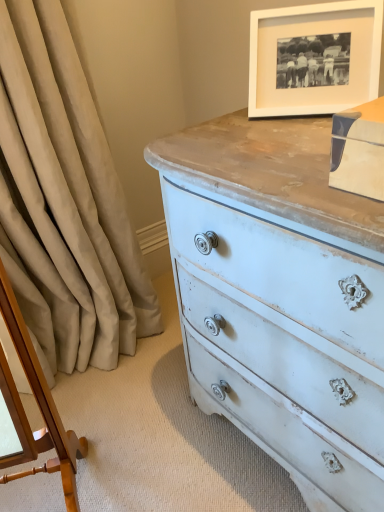
Locate an element on the screen. The height and width of the screenshot is (512, 384). wooden changing table at left is located at coordinates (40, 405).

What do you see at coordinates (64, 202) in the screenshot? The height and width of the screenshot is (512, 384). I see `beige fabric curtain at left` at bounding box center [64, 202].

What do you see at coordinates (314, 35) in the screenshot? The width and height of the screenshot is (384, 512). I see `white matte picture frame at upper right` at bounding box center [314, 35].

This screenshot has width=384, height=512. I want to click on wooden changing table at left, so click(40, 405).

Is white matte picture frame at upper right behind beige fabric curtain at left?

No, it is in front of beige fabric curtain at left.

Considering the relative sizes of white matte picture frame at upper right and beige fabric curtain at left in the image provided, is white matte picture frame at upper right thinner than beige fabric curtain at left?

Correct, the width of white matte picture frame at upper right is less than that of beige fabric curtain at left.

I want to click on curtain located behind the white matte picture frame at upper right, so click(64, 202).

Is white matte picture frame at upper right not inside wooden changing table at left?

Yes, white matte picture frame at upper right is located beyond the bounds of wooden changing table at left.

From a real-world perspective, is white matte picture frame at upper right beneath wooden changing table at left?

No.

Does white matte picture frame at upper right come in front of wooden changing table at left?

No, it is behind wooden changing table at left.

From the image's perspective, does wooden changing table at left appear lower than beige fabric curtain at left?

Yes, from the image's perspective, wooden changing table at left is below beige fabric curtain at left.

Is wooden changing table at left completely or partially outside of beige fabric curtain at left?

Indeed, wooden changing table at left is completely outside beige fabric curtain at left.

You are a GUI agent. You are given a task and a screenshot of the screen. Output one action in this format:
    pyautogui.click(x=<x>, y=<y>)
    Task: Click on the curtain located above the wooden changing table at left (from a real-world perspective)
    
    Given the screenshot: What is the action you would take?
    pyautogui.click(x=64, y=202)

Is wooden changing table at left thinner than beige fabric curtain at left?

Indeed, wooden changing table at left has a lesser width compared to beige fabric curtain at left.

Based on the photo, from a real-world perspective, who is located lower, beige fabric curtain at left or white matte picture frame at upper right?

beige fabric curtain at left is physically lower.

How much distance is there between beige fabric curtain at left and white matte picture frame at upper right?

27.62 inches.

Between point (136, 334) and point (251, 15), which one is positioned in front?

The point (251, 15) is closer.

Is beige fabric curtain at left aimed at white matte picture frame at upper right?

No, beige fabric curtain at left is not aimed at white matte picture frame at upper right.

Does point (73, 102) come closer to viewer compared to point (58, 445)?

No, (73, 102) is behind (58, 445).

Is wooden changing table at left completely or partially inside beige fabric curtain at left?

No, wooden changing table at left is not surrounded by beige fabric curtain at left.

Considering the sizes of beige fabric curtain at left and wooden changing table at left in the image, is beige fabric curtain at left taller or shorter than wooden changing table at left?

beige fabric curtain at left is taller than wooden changing table at left.

Where is `changing table lying on the left of beige fabric curtain at left`? The height and width of the screenshot is (512, 384). changing table lying on the left of beige fabric curtain at left is located at coordinates (40, 405).

Considering the relative sizes of wooden changing table at left and white matte picture frame at upper right in the image provided, is wooden changing table at left smaller than white matte picture frame at upper right?

No, wooden changing table at left is not smaller than white matte picture frame at upper right.

Is wooden changing table at left next to white matte picture frame at upper right?

No, wooden changing table at left is not making contact with white matte picture frame at upper right.

Considering the sizes of objects wooden changing table at left and white matte picture frame at upper right in the image provided, who is shorter, wooden changing table at left or white matte picture frame at upper right?

With less height is white matte picture frame at upper right.

Do you think wooden changing table at left is within white matte picture frame at upper right, or outside of it?

wooden changing table at left lies outside white matte picture frame at upper right.

This screenshot has height=512, width=384. I want to click on picture frame in front of the beige fabric curtain at left, so click(314, 35).

The height and width of the screenshot is (512, 384). In order to click on changing table that appears on the left of white matte picture frame at upper right in this screenshot , I will do `click(40, 405)`.

Based on their spatial positions, is wooden changing table at left or white matte picture frame at upper right further from beige fabric curtain at left?

white matte picture frame at upper right is further to beige fabric curtain at left.

Considering their positions, is beige fabric curtain at left positioned closer to white matte picture frame at upper right than wooden changing table at left?

beige fabric curtain at left lies closer to white matte picture frame at upper right than the other object.

Which object lies further to the anchor point wooden changing table at left, beige fabric curtain at left or white matte picture frame at upper right?

white matte picture frame at upper right is positioned further to the anchor wooden changing table at left.

From the picture: Looking at the image, which one is located closer to wooden changing table at left, white matte picture frame at upper right or beige fabric curtain at left?

The object closer to wooden changing table at left is beige fabric curtain at left.

From the image, which object appears to be nearer to beige fabric curtain at left, white matte picture frame at upper right or wooden changing table at left?

wooden changing table at left.

When comparing their distances from white matte picture frame at upper right, does wooden changing table at left or beige fabric curtain at left seem further?

wooden changing table at left.

Where is `curtain situated between wooden changing table at left and white matte picture frame at upper right from left to right`? curtain situated between wooden changing table at left and white matte picture frame at upper right from left to right is located at coordinates (64, 202).